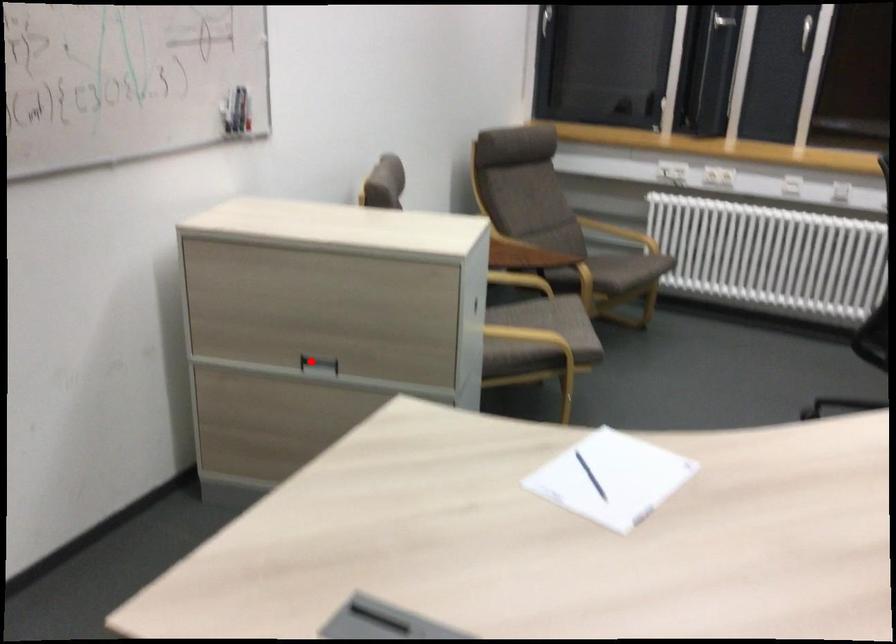
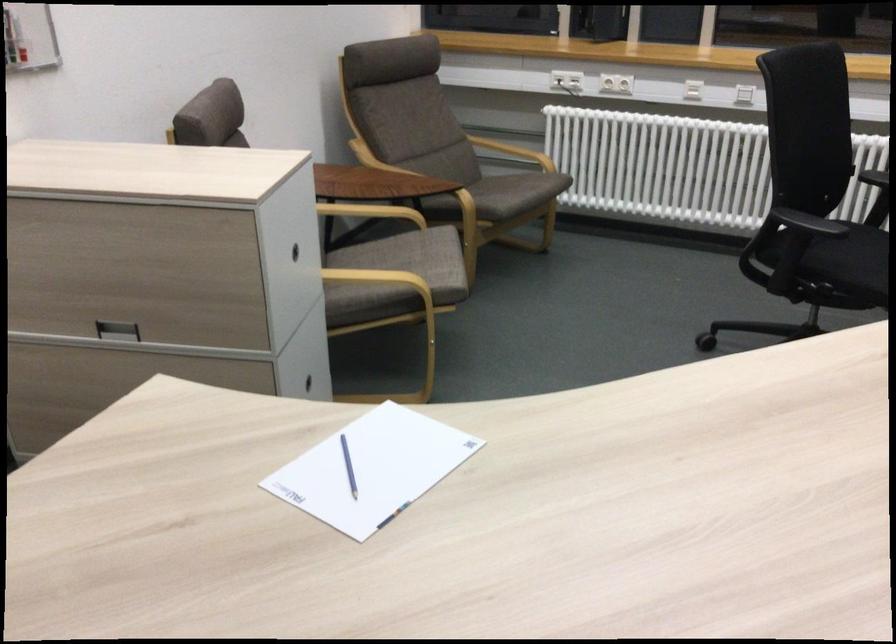
Where in the second image is the point corresponding to the highlighted location from the first image?

(116, 330)